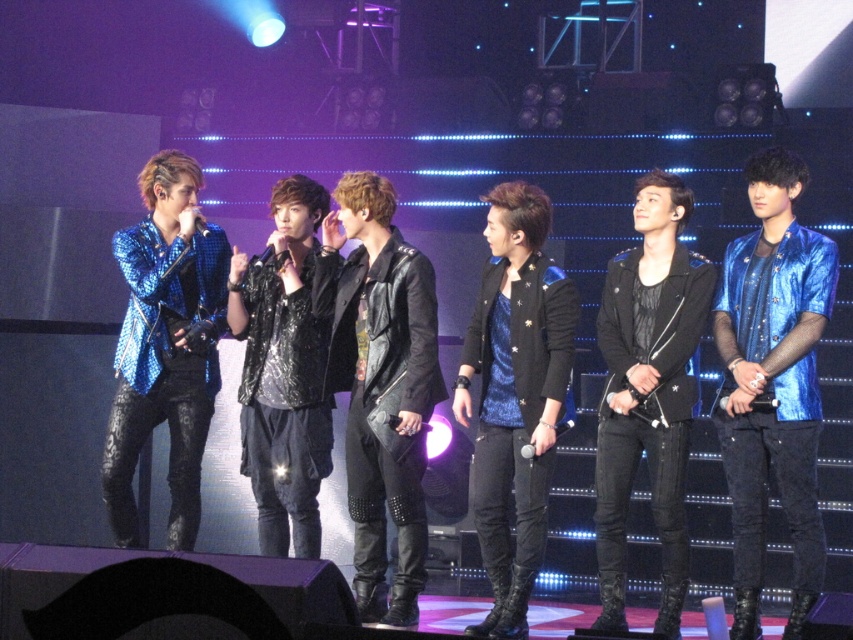
Between point (793, 589) and point (263, 419), which one is positioned behind?

Point (263, 419)

Is shiny blue jacket at center to the right of sequined black jacket at center from the viewer's perspective?

Indeed, shiny blue jacket at center is positioned on the right side of sequined black jacket at center.

The width and height of the screenshot is (853, 640). I want to click on shiny blue jacket at center, so (x=773, y=384).

Where is `shiny blue jacket at center`? shiny blue jacket at center is located at coordinates (773, 384).

Is shiny blue jacket at center taller than black leather jacket at center?

Yes, shiny blue jacket at center is taller than black leather jacket at center.

Which is more to the left, shiny blue jacket at center or black leather jacket at center?

From the viewer's perspective, black leather jacket at center appears more on the left side.

Based on the photo, who is more distant from viewer, [762,268] or [619,381]?

The point [619,381] is behind.

At what (x,y) coordinates should I click in order to perform the action: click on shiny blue jacket at center. Please return your answer as a coordinate pair (x, y). The height and width of the screenshot is (640, 853). Looking at the image, I should click on pyautogui.click(x=773, y=384).

Which is behind, point (476, 316) or point (257, 516)?

Point (257, 516)

Is point (566, 280) farther from viewer compared to point (281, 452)?

No, (566, 280) is closer to viewer.

Where is `metallic blue jacket at center`? metallic blue jacket at center is located at coordinates (515, 396).